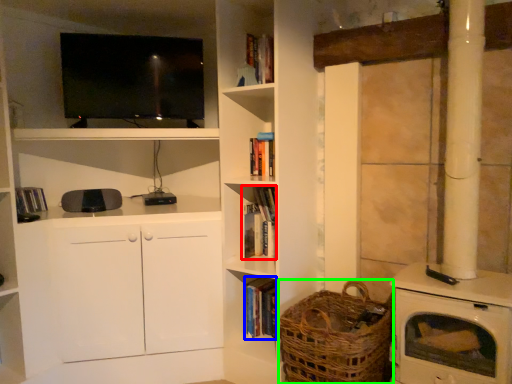
Question: Estimate the real-world distances between objects in this image. Which object is closer to book (highlighted by a red box), book (highlighted by a blue box) or basket (highlighted by a green box)?

Choices:
 (A) book
 (B) basket

Answer: (A)